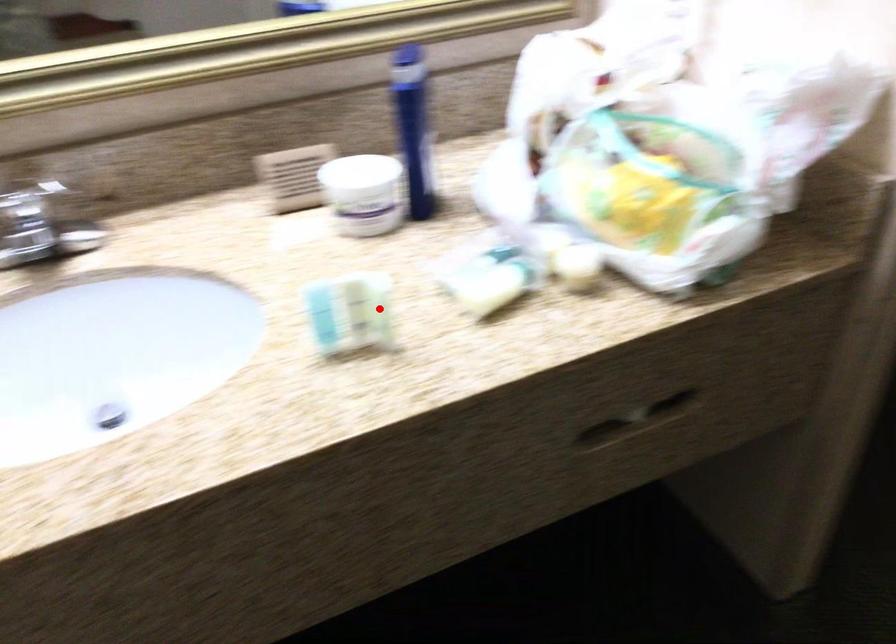
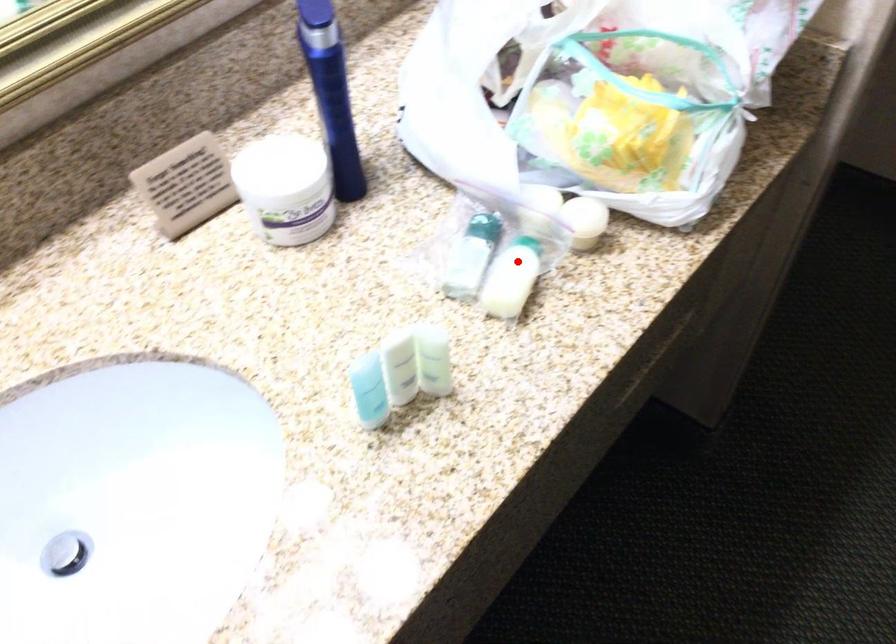
I am providing you with two images of the same scene from different viewpoints. A red point is marked on the first image and another point is marked on the second image. Is the red point in image1 aligned with the point shown in image2?

No